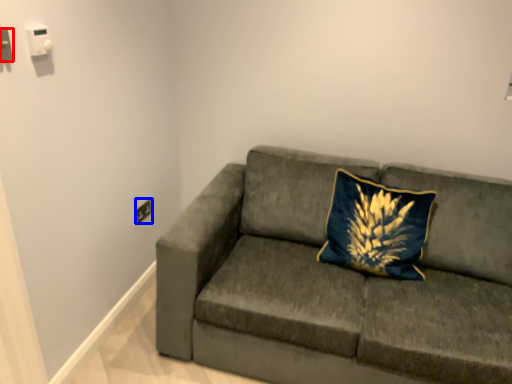
Question: Which object appears closest to the camera in this image, electric outlet (highlighted by a red box) or electric outlet (highlighted by a blue box)?

Choices:
 (A) electric outlet
 (B) electric outlet

Answer: (A)